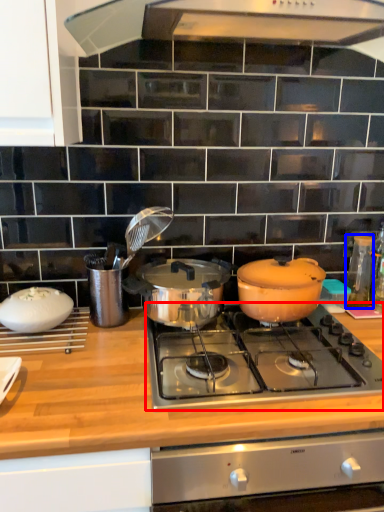
Question: Which object is closer to the camera taking this photo, gas stove (highlighted by a red box) or kitchen appliance (highlighted by a blue box)?

Choices:
 (A) gas stove
 (B) kitchen appliance

Answer: (A)